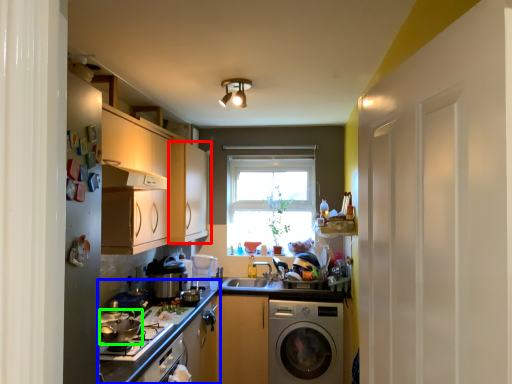
Question: Considering the real-world distances, which object is closest to cabinetry (highlighted by a red box)? countertop (highlighted by a blue box) or appliance (highlighted by a green box).

Choices:
 (A) countertop
 (B) appliance

Answer: (A)